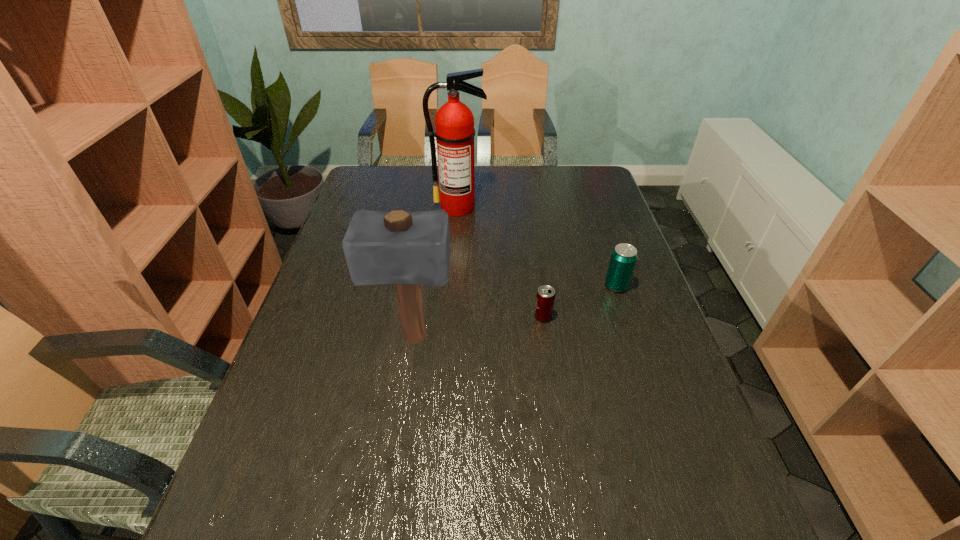
Image resolution: width=960 pixels, height=540 pixels. In order to click on vacant region located 0.360m on the back of the second object from right to left in this screenshot , I will do `click(531, 230)`.

This screenshot has height=540, width=960. I want to click on object that is at the far edge, so click(454, 122).

Find the location of a particular element. object that is at the right edge is located at coordinates (623, 259).

The height and width of the screenshot is (540, 960). Identify the location of vacant point at the far edge. (516, 171).

Identify the location of vacant space at the left edge. This screenshot has width=960, height=540. (337, 254).

The height and width of the screenshot is (540, 960). In order to click on vacant space at the right edge in this screenshot , I will do `click(597, 282)`.

At what (x,y) coordinates should I click in order to perform the action: click on vacant region at the far right corner. Please return your answer as a coordinate pair (x, y). This screenshot has height=540, width=960. Looking at the image, I should click on (572, 197).

The image size is (960, 540). I want to click on free space between the shorter beer can and the rightmost object, so click(580, 301).

Identify the location of vacant area between the third object from left to right and the second farthest object. (580, 301).

Locate an element on the screen. The height and width of the screenshot is (540, 960). vacant space that is in between the left beer can and the second tallest object is located at coordinates (478, 327).